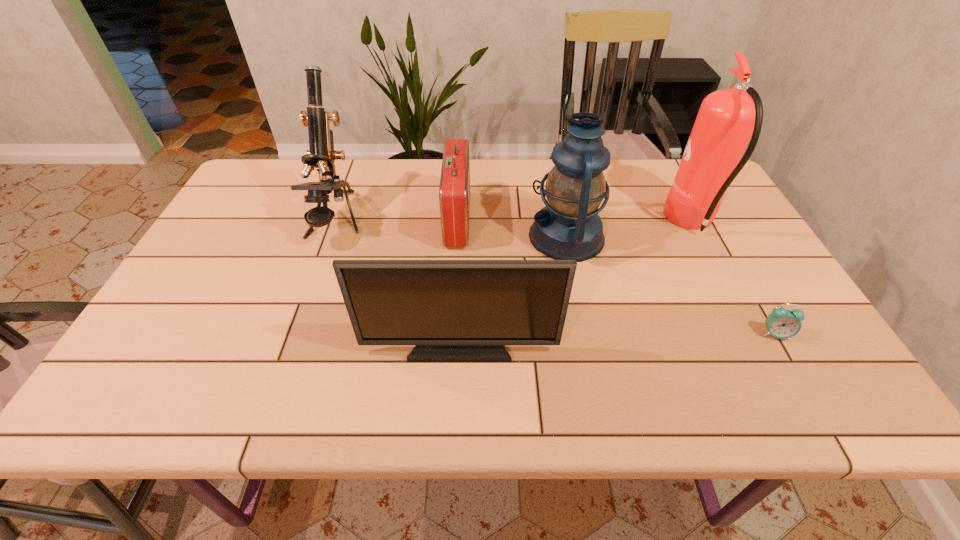
Find the location of `vacant space located 0.300m on the face of the lantern`. vacant space located 0.300m on the face of the lantern is located at coordinates (418, 237).

Where is `free space located 0.170m on the face of the lantern`? The height and width of the screenshot is (540, 960). free space located 0.170m on the face of the lantern is located at coordinates (466, 237).

The image size is (960, 540). I want to click on free space located 0.340m on the face of the lantern, so click(x=403, y=237).

Where is `vacant region located on the screen side of the third shortest object`? vacant region located on the screen side of the third shortest object is located at coordinates (458, 405).

Identify the location of free space located 0.300m on the side of the first-aid kit with the first aid cross symbol. The image size is (960, 540). (576, 220).

Find the location of a particular element. The image size is (960, 540). vacant region located 0.120m on the face of the shortest object is located at coordinates (808, 392).

You are a GUI agent. You are given a task and a screenshot of the screen. Output one action in this format:
    pyautogui.click(x=<x>, y=<y>)
    Task: Click on the fire extinguisher that is at the far edge
    The image size is (960, 540).
    Given the screenshot: What is the action you would take?
    pyautogui.click(x=727, y=119)

This screenshot has width=960, height=540. Find the location of `microscope located at the far edge`. microscope located at the far edge is located at coordinates (322, 155).

Locate an element on the screen. The image size is (960, 540). the first-aid kit situated at the far edge is located at coordinates (454, 191).

The height and width of the screenshot is (540, 960). Identify the location of fire extinguisher at the right edge. (727, 119).